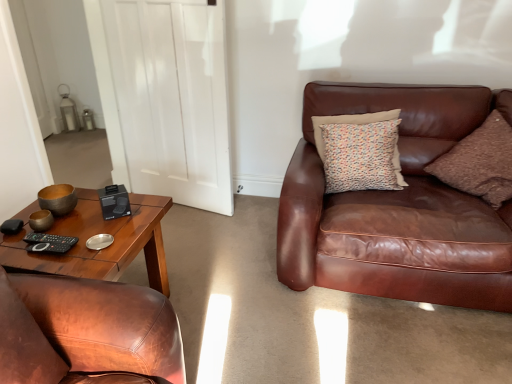
Question: Is black matte remote at lower left a part of brown leather chair at left?

Choices:
 (A) yes
 (B) no

Answer: (A)

Question: From a real-world perspective, is brown leather chair at left positioned under black matte remote at lower left based on gravity?

Choices:
 (A) no
 (B) yes

Answer: (B)

Question: Is brown leather chair at left thinner than black matte remote at lower left?

Choices:
 (A) no
 (B) yes

Answer: (A)

Question: Could you tell me if brown leather chair at left is facing black matte remote at lower left?

Choices:
 (A) yes
 (B) no

Answer: (B)

Question: Is brown leather chair at left next to black matte remote at lower left and touching it?

Choices:
 (A) yes
 (B) no

Answer: (B)

Question: From a real-world perspective, is black matte remote at lower left positioned above or below multicolored fabric pillow at upper right, which is counted as the 3th pillow, starting from the front?

Choices:
 (A) below
 (B) above

Answer: (A)

Question: In the image, is black matte remote at lower left on the left side or the right side of multicolored fabric pillow at upper right, which is counted as the second pillow, starting from the left?

Choices:
 (A) right
 (B) left

Answer: (B)

Question: Considering the positions of black matte remote at lower left and multicolored fabric pillow at upper right, which is the 1th pillow in back-to-front order, in the image, is black matte remote at lower left bigger or smaller than multicolored fabric pillow at upper right, which is the 1th pillow in back-to-front order,?

Choices:
 (A) small
 (B) big

Answer: (A)

Question: Is black matte remote at lower left taller or shorter than multicolored fabric pillow at upper right, placed as the second pillow when sorted from right to left?

Choices:
 (A) short
 (B) tall

Answer: (A)

Question: Is brown corduroy pillow at right, the 2th pillow viewed from the back, taller or shorter than multicolored fabric pillow at upper right, which is the 1th pillow in back-to-front order?

Choices:
 (A) short
 (B) tall

Answer: (B)

Question: From the image's perspective, relative to multicolored fabric pillow at upper right, which is counted as the 3th pillow, starting from the front, is brown corduroy pillow at right, the 2th pillow positioned from the front, above or below?

Choices:
 (A) below
 (B) above

Answer: (A)

Question: Is point (479, 157) closer or farther from the camera than point (357, 177)?

Choices:
 (A) closer
 (B) farther

Answer: (B)

Question: Is brown corduroy pillow at right, which ranks as the first pillow in right-to-left order, inside or outside of multicolored fabric pillow at upper right, which is the 1th pillow in back-to-front order?

Choices:
 (A) inside
 (B) outside

Answer: (B)

Question: From the image's perspective, is brown leather couch at right above or below brown corduroy pillow at right, which ranks as the first pillow in right-to-left order?

Choices:
 (A) above
 (B) below

Answer: (B)

Question: Would you say brown leather couch at right is to the left or to the right of brown corduroy pillow at right, which ranks as the first pillow in right-to-left order, in the picture?

Choices:
 (A) left
 (B) right

Answer: (A)